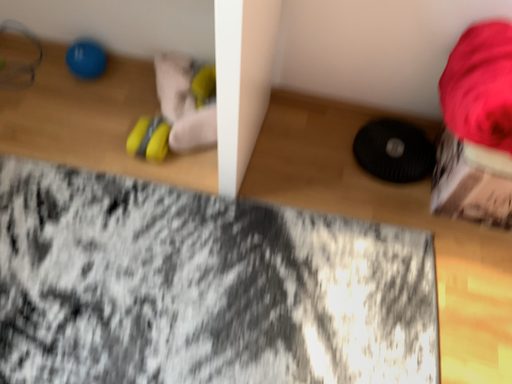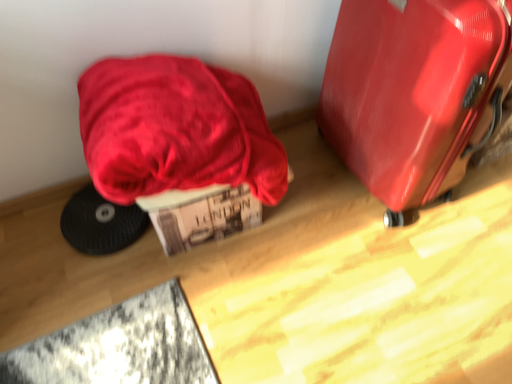
Question: Which way did the camera rotate in the video?

Choices:
 (A) rotated left
 (B) rotated right

Answer: (B)